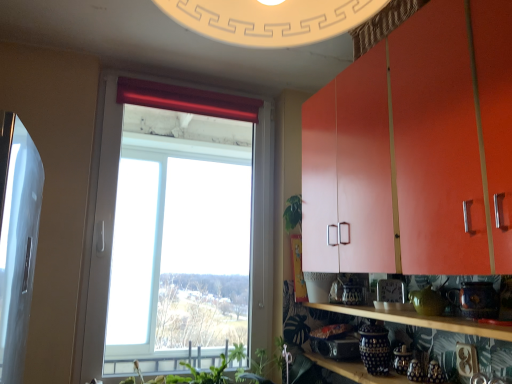
Question: Can you confirm if green leafy plant at lower center, acting as the 1th plant starting from the left, is shorter than red velvet curtain at upper center?

Choices:
 (A) yes
 (B) no

Answer: (B)

Question: Is green leafy plant at lower center, acting as the 1th plant starting from the left, thinner than red velvet curtain at upper center?

Choices:
 (A) yes
 (B) no

Answer: (B)

Question: Is green leafy plant at lower center, positioned as the 2th plant in right-to-left order, with red velvet curtain at upper center?

Choices:
 (A) yes
 (B) no

Answer: (B)

Question: Is the position of green leafy plant at lower center, acting as the 1th plant starting from the left, more distant than that of red velvet curtain at upper center?

Choices:
 (A) no
 (B) yes

Answer: (A)

Question: Is green leafy plant at lower center, acting as the 1th plant starting from the left, at the right side of red velvet curtain at upper center?

Choices:
 (A) yes
 (B) no

Answer: (A)

Question: Can you confirm if green leafy plant at lower center, positioned as the 2th plant in right-to-left order, is wider than red velvet curtain at upper center?

Choices:
 (A) yes
 (B) no

Answer: (A)

Question: From the image's perspective, would you say green leafy plant at lower center, the 1th plant viewed from the right, is shown under wooden shelf at lower right, the first shelf in the top-to-bottom sequence?

Choices:
 (A) no
 (B) yes

Answer: (B)

Question: Is green leafy plant at lower center, the 2th plant viewed from the left, behind wooden shelf at lower right, the first shelf in the top-to-bottom sequence?

Choices:
 (A) no
 (B) yes

Answer: (B)

Question: Does green leafy plant at lower center, the 2th plant viewed from the left, have a smaller size compared to wooden shelf at lower right, the first shelf in the top-to-bottom sequence?

Choices:
 (A) yes
 (B) no

Answer: (B)

Question: Does green leafy plant at lower center, the 1th plant viewed from the right, have a greater height compared to wooden shelf at lower right, acting as the 2th shelf starting from the bottom?

Choices:
 (A) no
 (B) yes

Answer: (B)

Question: Are green leafy plant at lower center, the 1th plant viewed from the right, and wooden shelf at lower right, acting as the 2th shelf starting from the bottom, far apart?

Choices:
 (A) no
 (B) yes

Answer: (A)

Question: Is green leafy plant at lower center, the 1th plant viewed from the right, shorter than wooden shelf at lower right, the first shelf in the top-to-bottom sequence?

Choices:
 (A) yes
 (B) no

Answer: (B)

Question: Is transparent glass window at center turned away from wooden shelf at lower right, acting as the 2th shelf starting from the bottom?

Choices:
 (A) no
 (B) yes

Answer: (A)